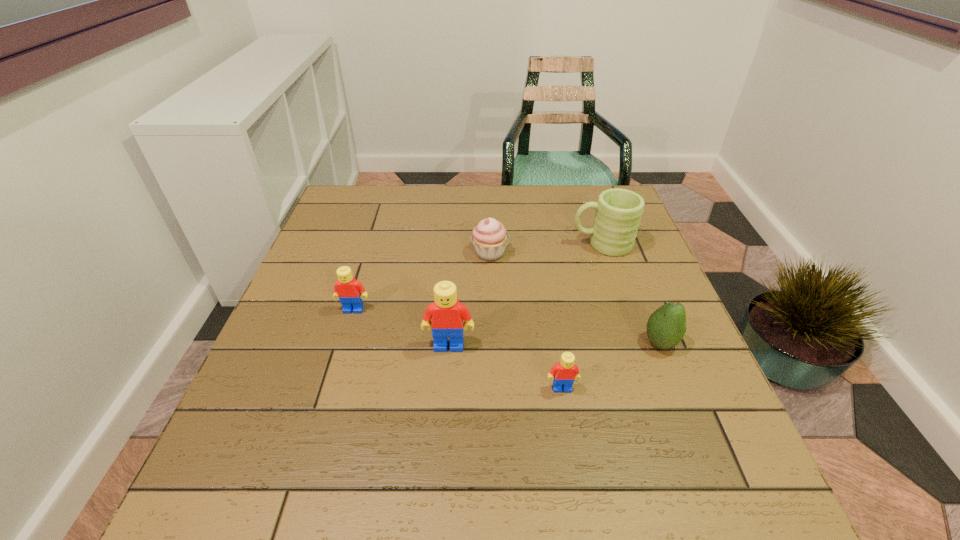
Locate an element on the screen. This screenshot has height=540, width=960. the second shortest Lego is located at coordinates (350, 291).

Identify the location of the leftmost Lego. (350, 291).

Where is `the second farthest Lego`? the second farthest Lego is located at coordinates (447, 313).

Identify the location of the tallest object. This screenshot has width=960, height=540. (447, 313).

Find the location of `the nearest object`. the nearest object is located at coordinates (564, 373).

Locate an element on the screen. The height and width of the screenshot is (540, 960). the shortest Lego is located at coordinates tap(564, 373).

Where is `avocado`? avocado is located at coordinates (666, 326).

Locate an element on the screen. Image resolution: width=960 pixels, height=540 pixels. cupcake is located at coordinates (489, 237).

You are a GUI agent. You are given a task and a screenshot of the screen. Output one action in this format:
    pyautogui.click(x=<x>, y=<y>)
    Task: Click on the mug
    Image resolution: width=960 pixels, height=540 pixels.
    Given the screenshot: What is the action you would take?
    pyautogui.click(x=618, y=213)

Locate an element on the screen. vacant region located on the face of the leftmost object is located at coordinates (314, 441).